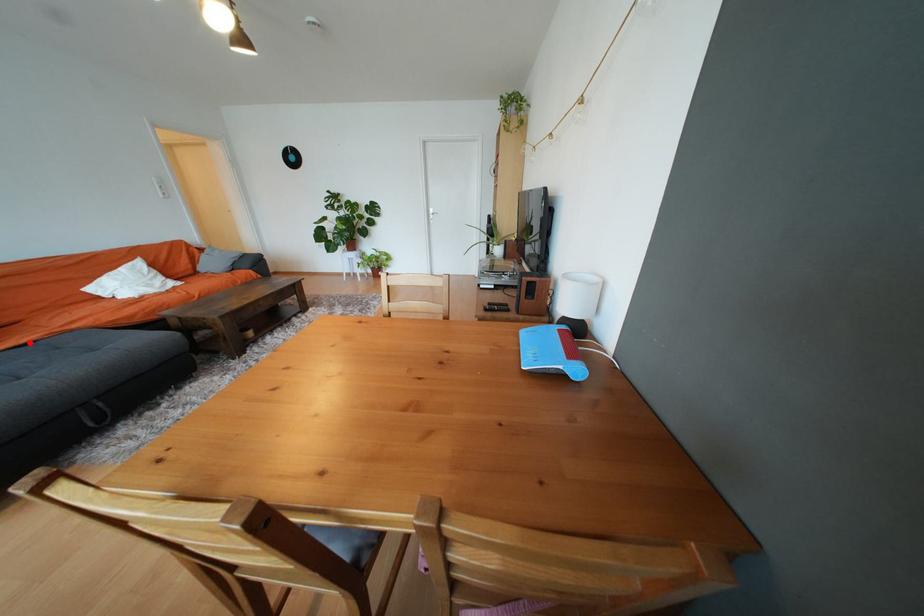
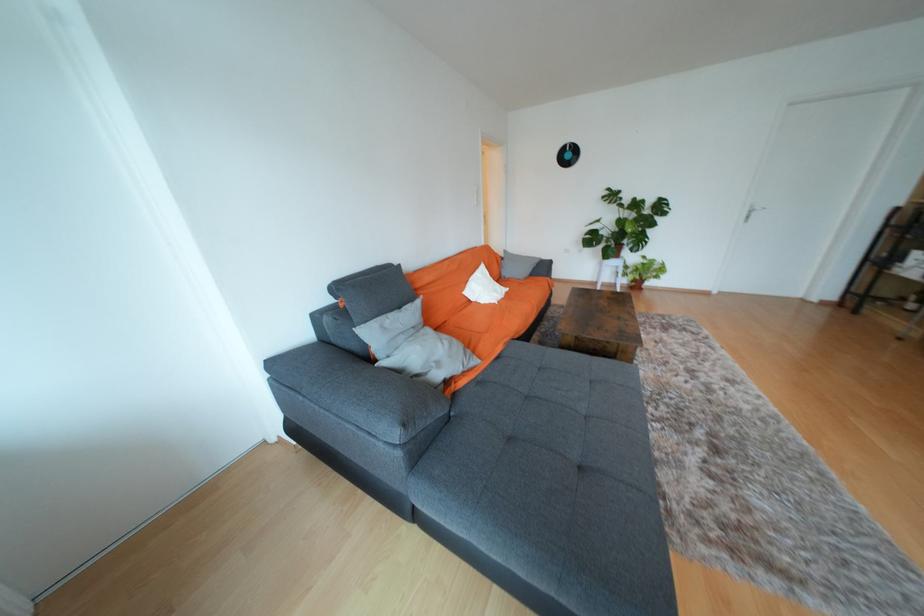
In the second image, find the point that corresponds to the highlighted location in the first image.

(504, 353)